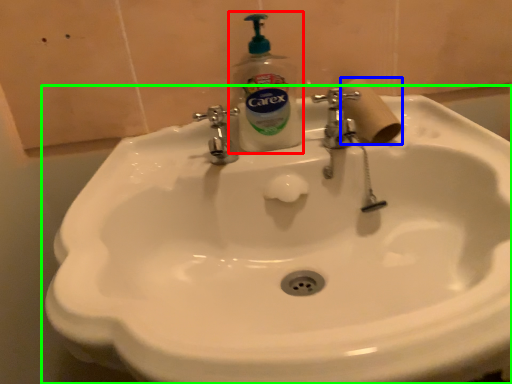
Question: Which object is the farthest from soap dispenser (highlighted by a red box)? Choose among these: toilet paper (highlighted by a blue box) or sink (highlighted by a green box).

Choices:
 (A) toilet paper
 (B) sink

Answer: (B)